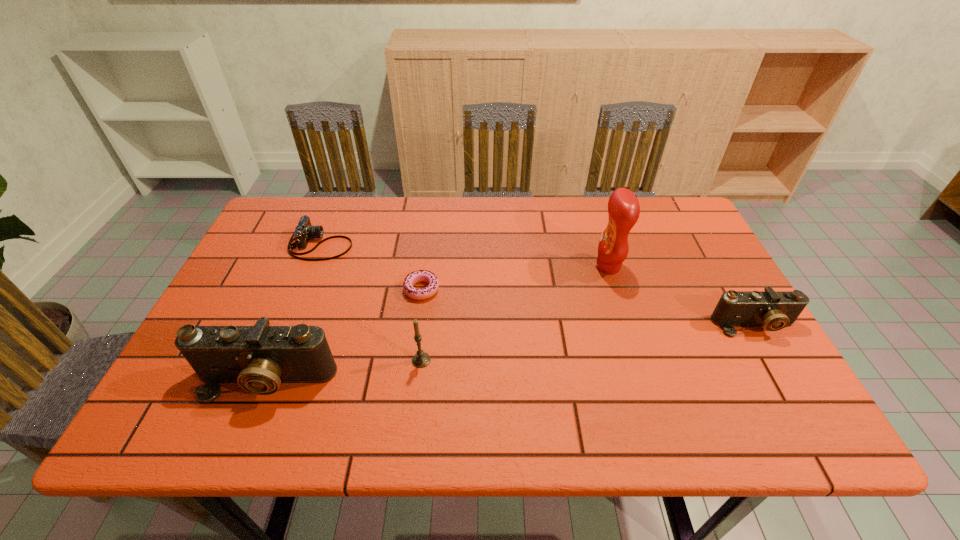
Where is `the nearest camera`? The image size is (960, 540). the nearest camera is located at coordinates (259, 358).

Locate an element on the screen. This screenshot has width=960, height=540. the second shortest camera is located at coordinates (774, 310).

Locate an element on the screen. the third nearest object is located at coordinates (774, 310).

Image resolution: width=960 pixels, height=540 pixels. I want to click on the fifth tallest object, so click(304, 231).

You are a GUI agent. You are given a task and a screenshot of the screen. Output one action in this format:
    pyautogui.click(x=<x>, y=<y>)
    Task: Click on the farthest camera
    This screenshot has width=960, height=540.
    Given the screenshot: What is the action you would take?
    pyautogui.click(x=304, y=231)

Identify the location of condiment. [623, 207].

Where is `the tallest object`? Image resolution: width=960 pixels, height=540 pixels. the tallest object is located at coordinates (623, 207).

Where is `doughnut`? Image resolution: width=960 pixels, height=540 pixels. doughnut is located at coordinates (419, 276).

You are a GUI agent. You are given a task and a screenshot of the screen. Output one action in this format:
    pyautogui.click(x=<x>, y=<y>)
    Task: Click on the candle
    This screenshot has height=540, width=960.
    Given the screenshot: What is the action you would take?
    pyautogui.click(x=421, y=359)

Identify the location of free region located 0.120m on the front-facing side of the rightmost object. [x=787, y=382].